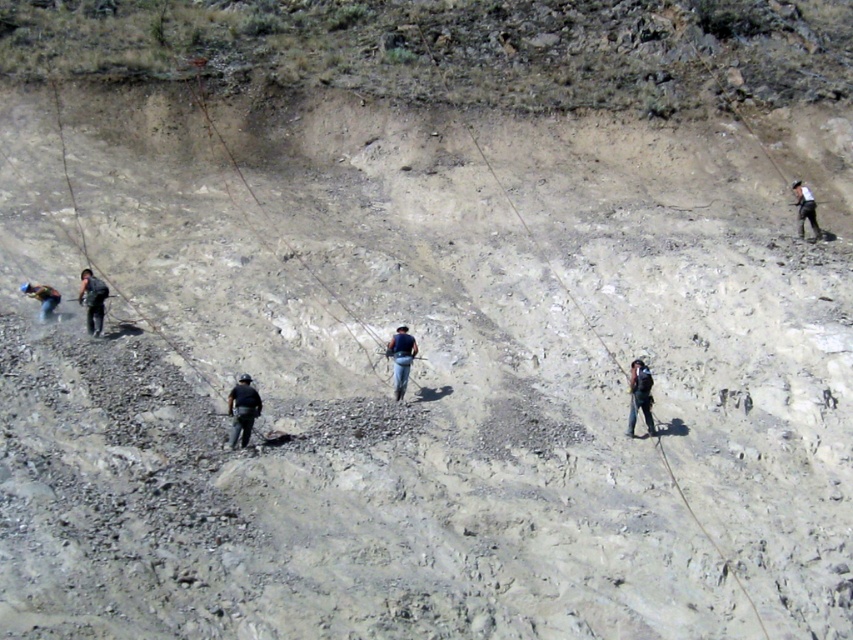
You are a safety inspector assessing the mining site. You notice two workers, one wearing a dark blue uniform at center and another wearing dark blue jeans at right. Which worker is wearing clothing with a narrower width?

The dark blue uniform at center has a narrower width compared to the dark blue jeans at right.

You are a safety inspector at the mining site. You need to ensure that all equipment is within a safe distance of 10 meters from each other to prevent accidents. Are the dark blue fabric backpack at center and blue denim jeans at lower left within the required distance?

The distance between the dark blue fabric backpack at center and the blue denim jeans at lower left is 10.97 meters, which exceeds the 10 meter safety requirement. Therefore, they are not within the required safe distance.